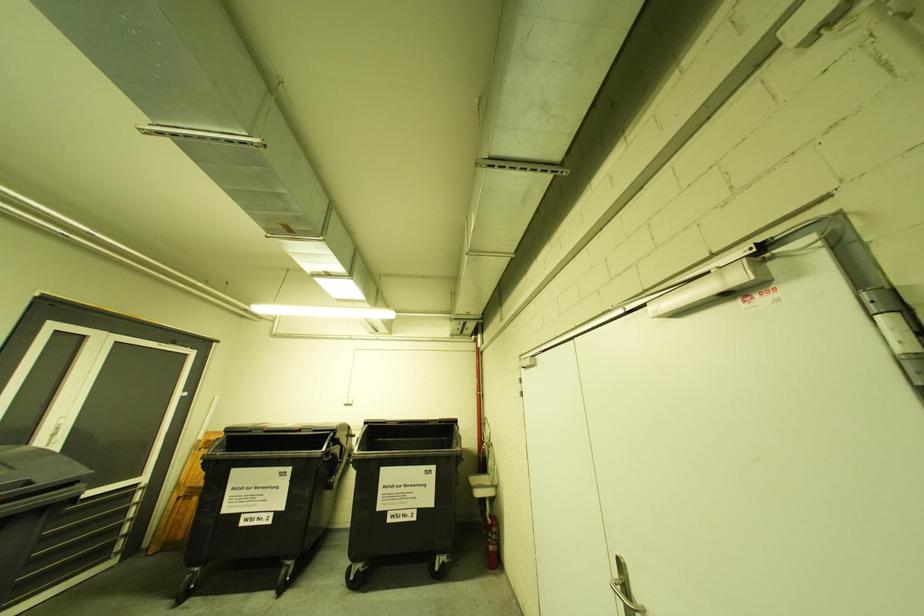
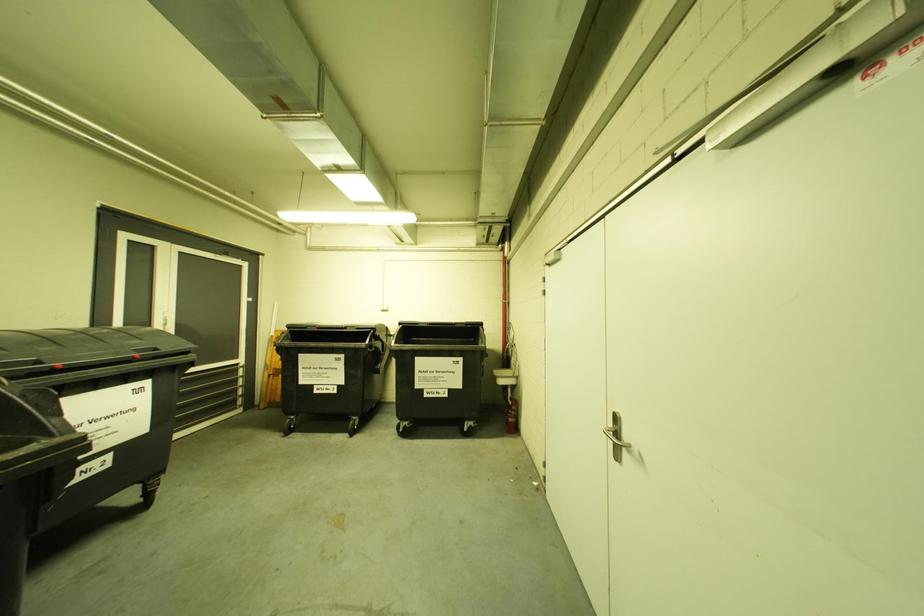
Question: How did the camera likely rotate?

Choices:
 (A) Left
 (B) Right
 (C) Up
 (D) Down

Answer: (D)